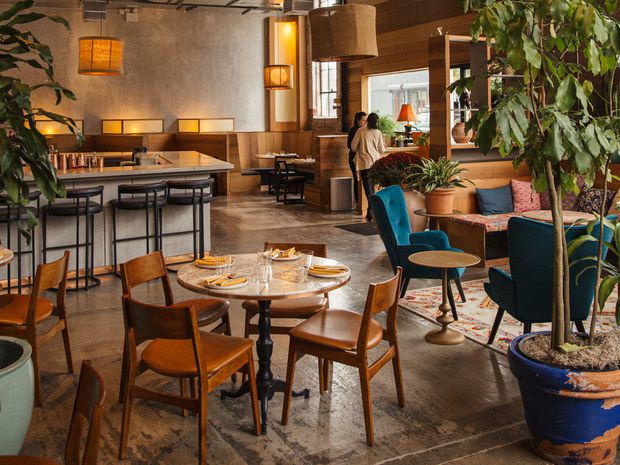
This screenshot has height=465, width=620. Identify the location of black chairs. (193, 188), (140, 197), (79, 202), (32, 206).